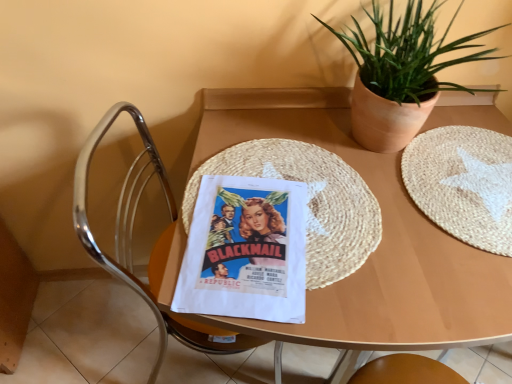
This screenshot has height=384, width=512. Identify the location of vacant area located to the right-hand side of green leafy plant in clay pot at upper right. (474, 145).